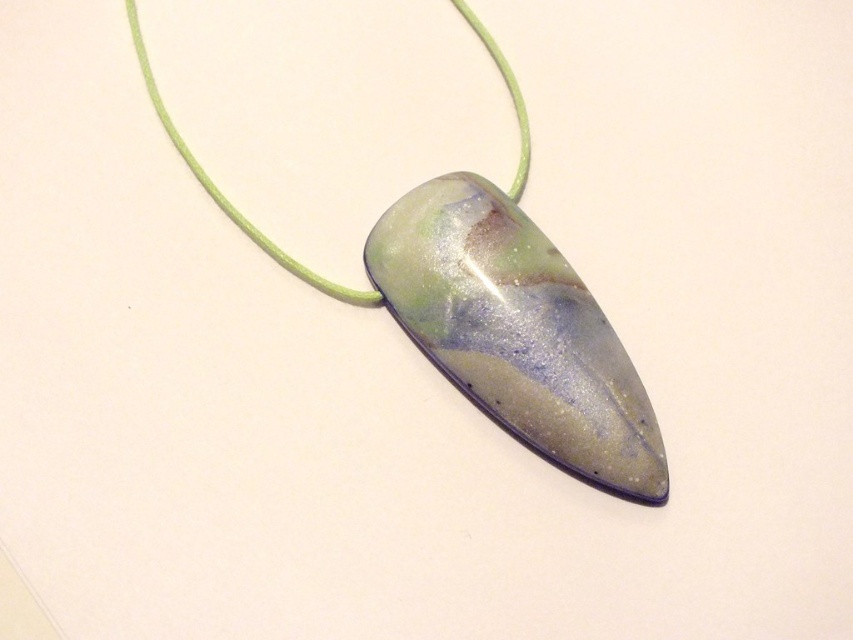
Can you confirm if translucent glass pendant at center is positioned above translucent marbled stone pendant at center?

Indeed, translucent glass pendant at center is positioned over translucent marbled stone pendant at center.

Is translucent glass pendant at center wider than translucent marbled stone pendant at center?

Yes, translucent glass pendant at center is wider than translucent marbled stone pendant at center.

Who is more forward, (460, 212) or (445, 305)?

Point (445, 305) is in front.

What are the coordinates of `translucent glass pendant at center` in the screenshot? It's located at (494, 312).